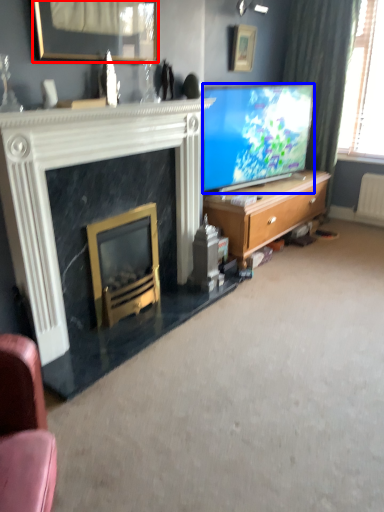
Question: Among these objects, which one is nearest to the camera, picture frame (highlighted by a red box) or television (highlighted by a blue box)?

Choices:
 (A) picture frame
 (B) television

Answer: (A)